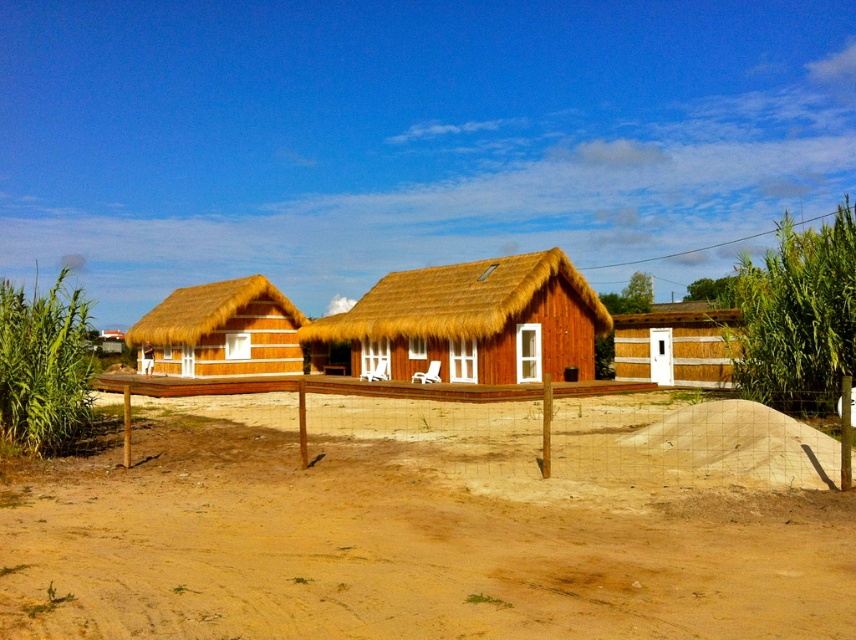
You are standing at the point marked as point (528, 424) in the image. What structure are you currently on?

You are on the wooden fence at center because the point (528, 424) is located on it.

You are a delivery drone with a maximum flight range of 10 meters. You need to deliver a package from the brown sandy dirt field at lower center to the wooden hut at center. Can you make the delivery without needing to recharge?

The distance between the brown sandy dirt field at lower center and the wooden hut at center is 9.96 meters, which is within the drone s 10 meter range. Yes, the drone can make the delivery without needing to recharge.